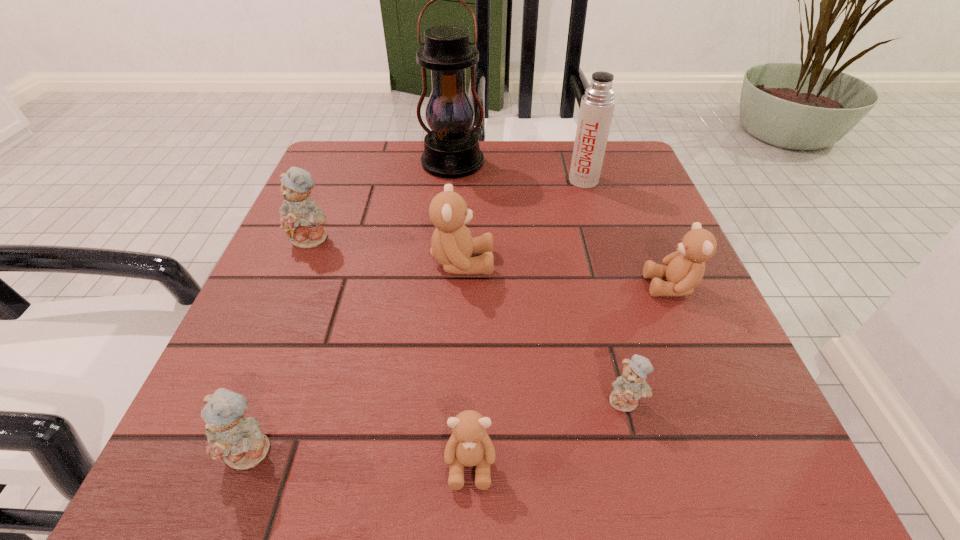
Image resolution: width=960 pixels, height=540 pixels. Find the location of `empty location between the lantern and the farthest blue teddy bear`. empty location between the lantern and the farthest blue teddy bear is located at coordinates (383, 201).

Find the location of `empty location between the lantern and the nearest brown teddy bear`. empty location between the lantern and the nearest brown teddy bear is located at coordinates (462, 314).

The width and height of the screenshot is (960, 540). Identify the location of vacant region between the second smallest brown teddy bear and the lantern. (562, 225).

The width and height of the screenshot is (960, 540). In order to click on vacant area that lies between the smallest blue teddy bear and the black lantern in this screenshot , I will do `click(539, 282)`.

The image size is (960, 540). What are the coordinates of `free space between the biggest blue teddy bear and the nearest blue teddy bear` in the screenshot? It's located at (282, 345).

Find the location of a particular element. This screenshot has width=960, height=540. unoccupied area between the lantern and the second nearest blue teddy bear is located at coordinates (539, 282).

Find the location of a particular element. The width and height of the screenshot is (960, 540). unoccupied area between the nearest blue teddy bear and the thermos bottle is located at coordinates (418, 316).

Select which object is the sixth closest to the biggest brown teddy bear. Please provide its 2D coordinates. Your answer should be formatted as a tuple, i.e. [(x, y)], where the tuple contains the x and y coordinates of a point satisfying the conditions above.

[(469, 445)]

Find the location of a particular element. This screenshot has width=960, height=540. object that is the fourth closest one to the thermos bottle is located at coordinates (627, 389).

Choose which teddy bear is the third nearest neighbor to the smallest brown teddy bear. Please provide its 2D coordinates. Your answer should be formatted as a tuple, i.e. [(x, y)], where the tuple contains the x and y coordinates of a point satisfying the conditions above.

[(452, 245)]